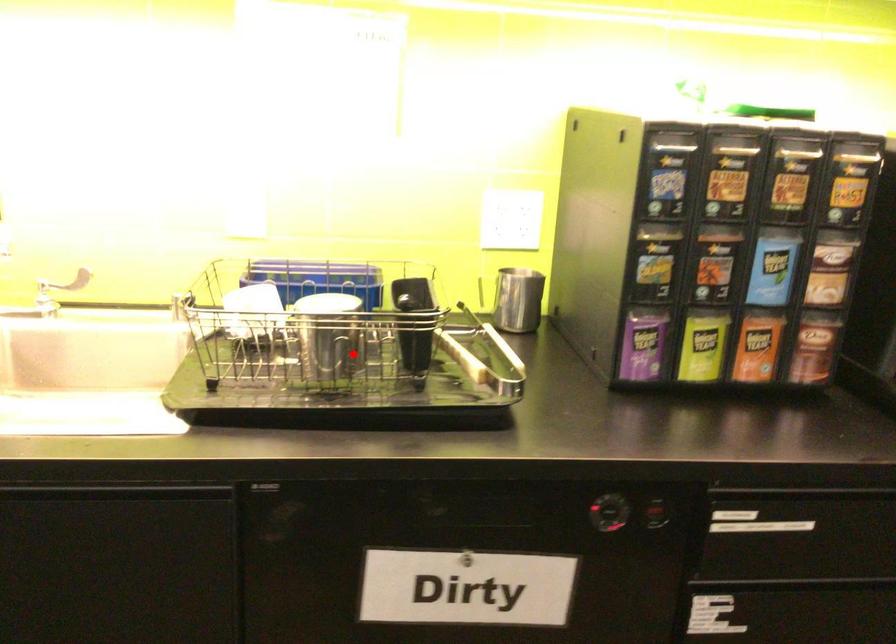
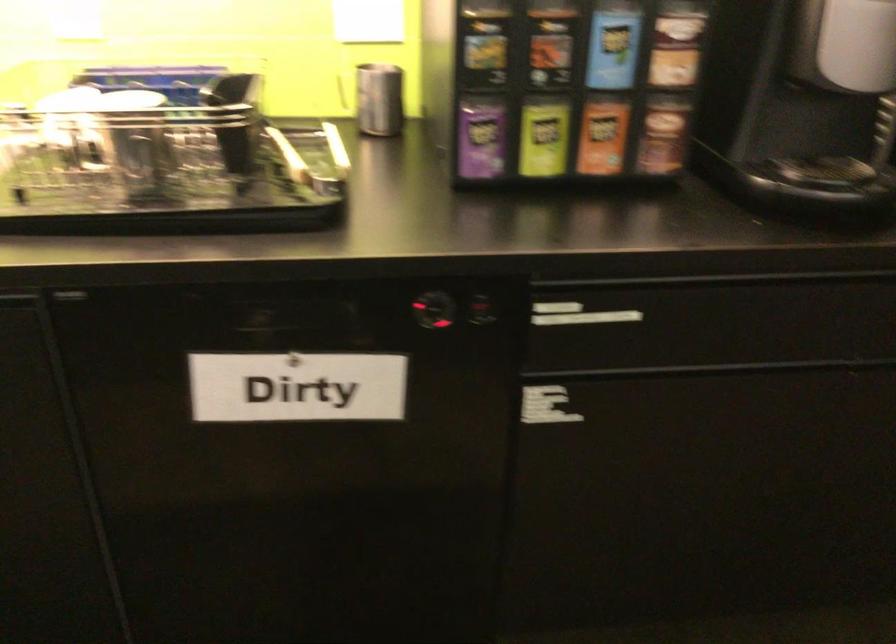
Find the pixel in the second image that matches the highlighted location in the first image.

(164, 156)